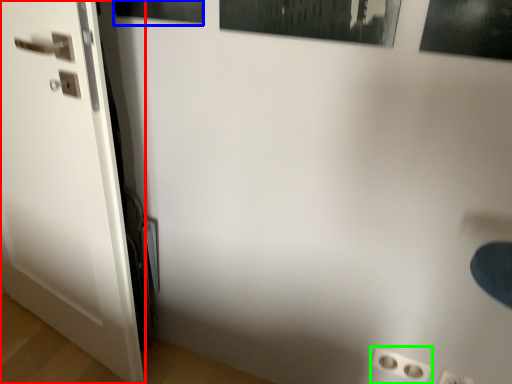
Question: Considering the real-world distances, which object is farthest from door (highlighted by a red box)? picture frame (highlighted by a blue box) or electric outlet (highlighted by a green box)?

Choices:
 (A) picture frame
 (B) electric outlet

Answer: (B)